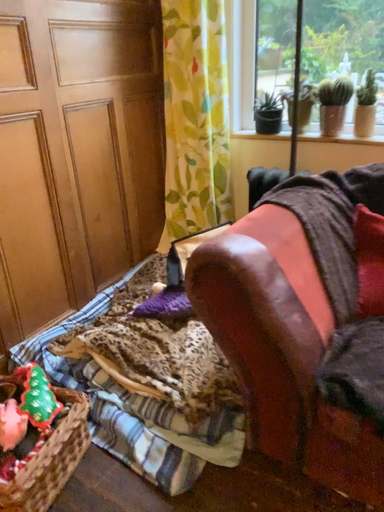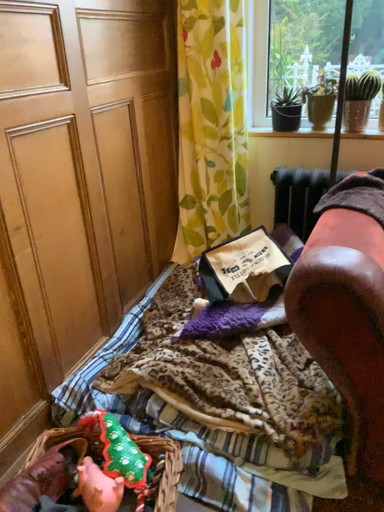
Question: Which way did the camera rotate in the video?

Choices:
 (A) rotated right
 (B) rotated left

Answer: (A)